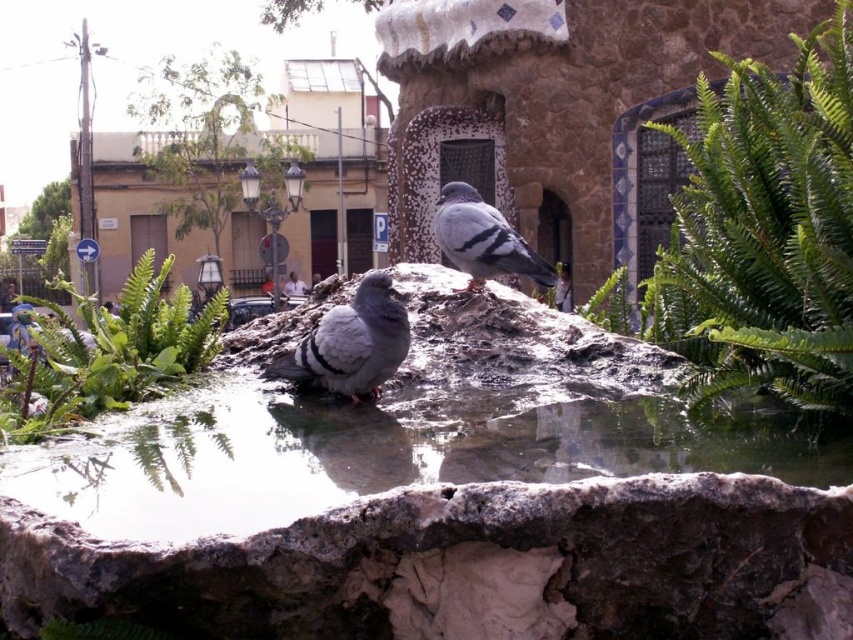
Which of these two, green leafy plant at upper center or gray matte pigeon at center, stands shorter?

gray matte pigeon at center

Does green leafy plant at upper center have a smaller size compared to gray matte pigeon at center?

Incorrect, green leafy plant at upper center is not smaller in size than gray matte pigeon at center.

At what (x,y) coordinates should I click in order to perform the action: click on green leafy plant at upper center. Please return your answer as a coordinate pair (x, y). The image size is (853, 640). Looking at the image, I should click on pos(763,230).

Which of these two, clear water at center or white fabric couple at center, stands shorter?

clear water at center

Is clear water at center above white fabric couple at center?

No.

The width and height of the screenshot is (853, 640). Identify the location of clear water at center. (370, 456).

Is clear water at center positioned in front of green leafy plant at upper center?

Yes, clear water at center is closer to the viewer.

Can you confirm if clear water at center is shorter than green leafy plant at upper center?

Correct, clear water at center is not as tall as green leafy plant at upper center.

Find the location of `clear water at center`. clear water at center is located at coordinates point(370,456).

I want to click on clear water at center, so click(370, 456).